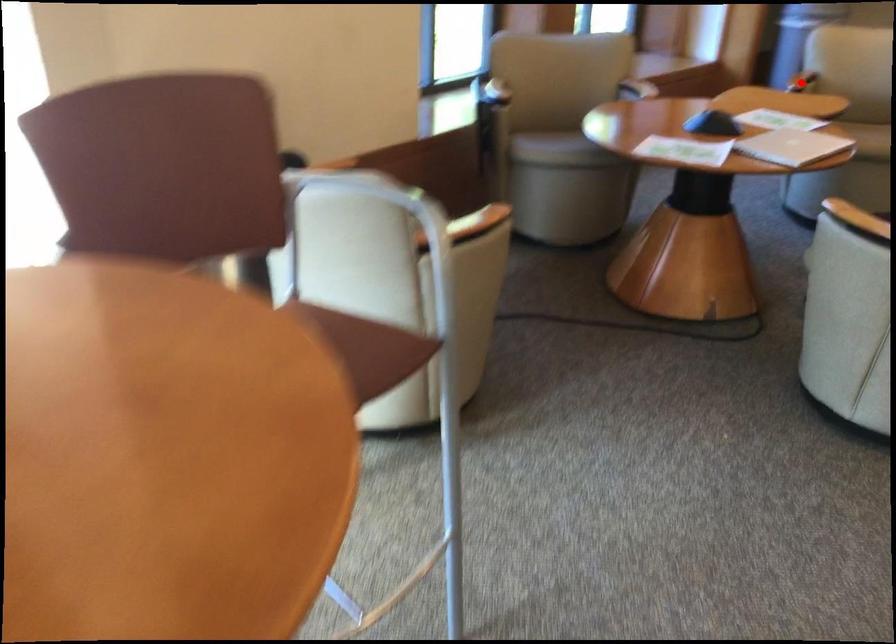
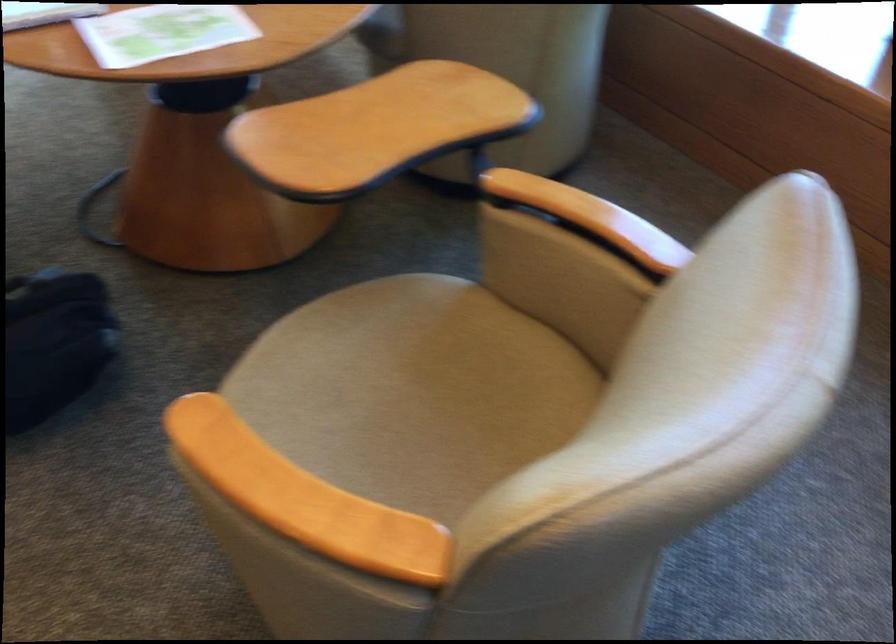
Question: I am providing you with two images of the same scene from different viewpoints. A red point is marked on the first image. Is the red point's position out of view in image 2?

Choices:
 (A) Yes
 (B) No

Answer: (A)